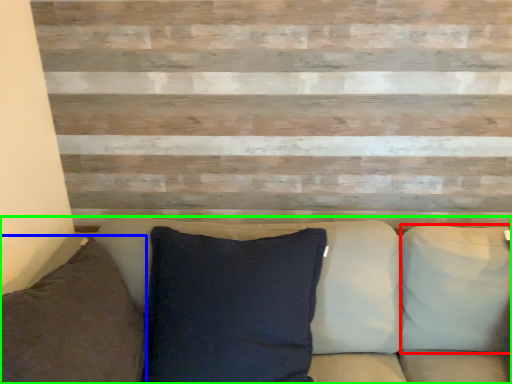
Question: Estimate the real-world distances between objects in this image. Which object is farther from pillow (highlighted by a red box), pillow (highlighted by a blue box) or studio couch (highlighted by a green box)?

Choices:
 (A) pillow
 (B) studio couch

Answer: (A)